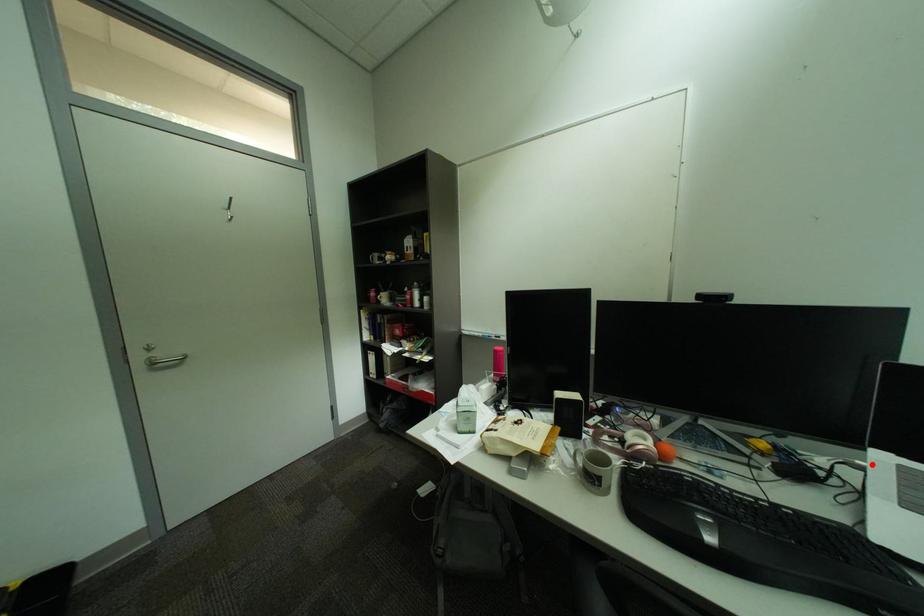
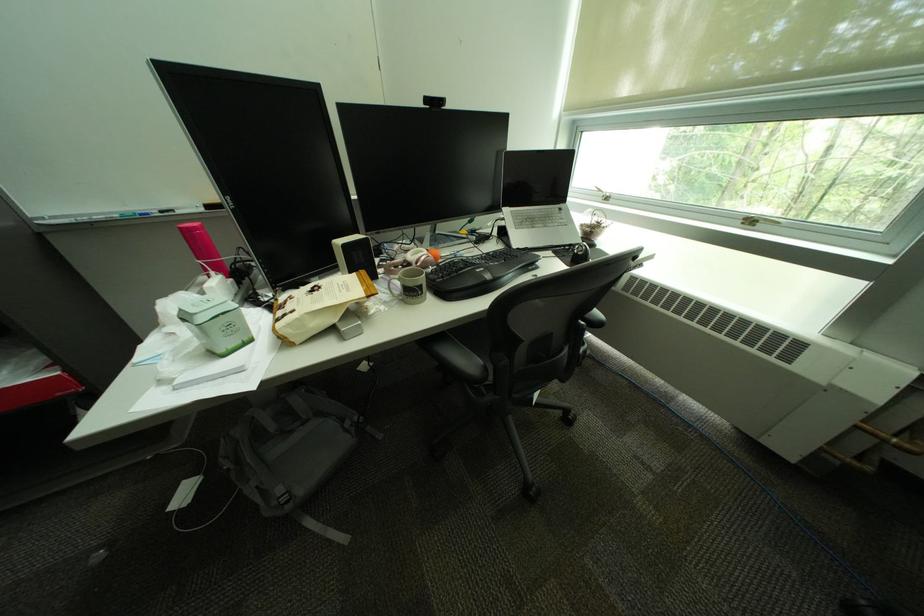
Question: A red point is marked in image1. In image2, is the corresponding 3D point closer to the camera or farther? Reply with the corresponding letter.

Choices:
 (A) The corresponding 3D point is closer.
 (B) The corresponding 3D point is farther.

Answer: (A)